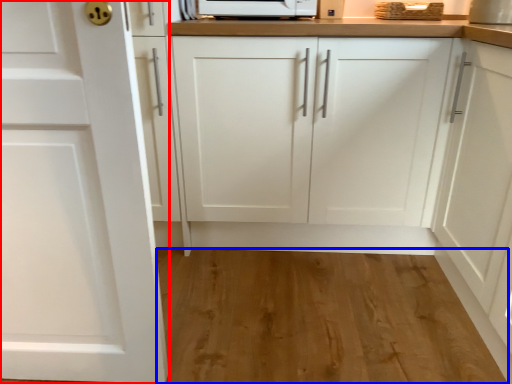
Question: Among these objects, which one is nearest to the camera, cabinetry (highlighted by a red box) or hardwood (highlighted by a blue box)?

Choices:
 (A) cabinetry
 (B) hardwood

Answer: (A)